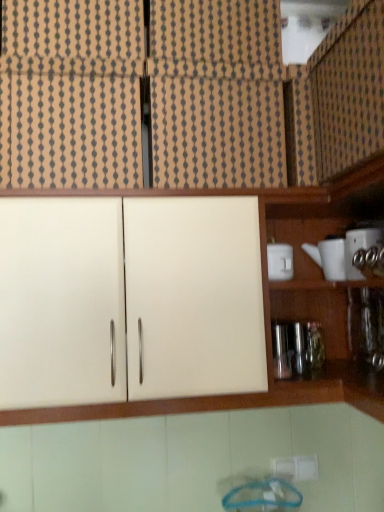
What do you see at coordinates (280, 261) in the screenshot? I see `white glossy cup at upper right, the third appliance in the right-to-left sequence` at bounding box center [280, 261].

I want to click on white glossy teapot at right, which is the first appliance from right to left, so click(x=359, y=247).

The height and width of the screenshot is (512, 384). What do you see at coordinates (70, 131) in the screenshot? I see `white matte cabinet at upper left, which is the third cabinetry in top-to-bottom order` at bounding box center [70, 131].

The width and height of the screenshot is (384, 512). Describe the element at coordinates (314, 345) in the screenshot. I see `metallic silver bottle at right` at that location.

The width and height of the screenshot is (384, 512). Find the location of `white ceramic teapot at right, which ranks as the second appliance in right-to-left order`. white ceramic teapot at right, which ranks as the second appliance in right-to-left order is located at coordinates (329, 258).

Find the location of `matte wood cabinet at upper center, the second cabinetry when ordered from top to bottom`. matte wood cabinet at upper center, the second cabinetry when ordered from top to bottom is located at coordinates (217, 133).

Which of these two, matte wood cabinet at upper right, the 4th cabinetry positioned from the bottom, or white ceramic teapot at right, which ranks as the second appliance in right-to-left order, stands shorter?

Standing shorter between the two is white ceramic teapot at right, which ranks as the second appliance in right-to-left order.

Considering the points (363, 5) and (335, 272), which point is behind, point (363, 5) or point (335, 272)?

Positioned behind is point (335, 272).

Can you tell me how much matte wood cabinet at upper right, the 1th cabinetry in the top-to-bottom sequence, and white ceramic teapot at right, which is the second appliance in left-to-right order, differ in facing direction?

matte wood cabinet at upper right, the 1th cabinetry in the top-to-bottom sequence, and white ceramic teapot at right, which is the second appliance in left-to-right order, are facing 89.6 degrees away from each other.

Is matte wood cabinet at upper right, the 1th cabinetry in the top-to-bottom sequence, touching white ceramic teapot at right, which is the second appliance in left-to-right order?

No, matte wood cabinet at upper right, the 1th cabinetry in the top-to-bottom sequence, is not beside white ceramic teapot at right, which is the second appliance in left-to-right order.

Considering the sizes of matte wood cabinet at upper right, the 4th cabinetry positioned from the bottom, and metallic silver bottle at right in the image, is matte wood cabinet at upper right, the 4th cabinetry positioned from the bottom, taller or shorter than metallic silver bottle at right?

Clearly, matte wood cabinet at upper right, the 4th cabinetry positioned from the bottom, is taller compared to metallic silver bottle at right.

Measure the distance from matte wood cabinet at upper right, the 1th cabinetry in the top-to-bottom sequence, to metallic silver bottle at right.

A distance of 24.94 inches exists between matte wood cabinet at upper right, the 1th cabinetry in the top-to-bottom sequence, and metallic silver bottle at right.

From the image's perspective, would you say matte wood cabinet at upper right, the 1th cabinetry in the top-to-bottom sequence, is positioned over metallic silver bottle at right?

Correct, matte wood cabinet at upper right, the 1th cabinetry in the top-to-bottom sequence, appears higher than metallic silver bottle at right in the image.

From a real-world perspective, is matte wood cabinet at upper right, the 1th cabinetry in the top-to-bottom sequence, above or below metallic silver bottle at right?

Clearly, from a real-world perspective, matte wood cabinet at upper right, the 1th cabinetry in the top-to-bottom sequence, is above metallic silver bottle at right.

Locate an element on the screen. The height and width of the screenshot is (512, 384). the 2nd appliance below when counting from the white glossy teapot at right, which is the first appliance from right to left (from the image's perspective) is located at coordinates (280, 261).

Who is shorter, white glossy teapot at right, the 3th appliance in the left-to-right sequence, or white glossy cup at upper right, arranged as the 1th appliance when viewed from the left?

With less height is white glossy cup at upper right, arranged as the 1th appliance when viewed from the left.

Are white glossy teapot at right, the 3th appliance in the left-to-right sequence, and white glossy cup at upper right, arranged as the 1th appliance when viewed from the left, making contact?

No, white glossy teapot at right, the 3th appliance in the left-to-right sequence, is not making contact with white glossy cup at upper right, arranged as the 1th appliance when viewed from the left.

From the picture: How many degrees apart are the facing directions of matte wood cabinet at upper center, the 3th cabinetry positioned from the bottom, and metallic silver bottle at right?

The angle between the facing direction of matte wood cabinet at upper center, the 3th cabinetry positioned from the bottom, and the facing direction of metallic silver bottle at right is 1.67 degrees.

This screenshot has height=512, width=384. I want to click on bottle lying behind the matte wood cabinet at upper center, the 3th cabinetry positioned from the bottom, so click(314, 345).

Between matte wood cabinet at upper center, the second cabinetry when ordered from top to bottom, and metallic silver bottle at right, which one has smaller size?

metallic silver bottle at right is smaller.

Would you say matte wood cabinet at upper center, the second cabinetry when ordered from top to bottom, is outside metallic silver bottle at right?

matte wood cabinet at upper center, the second cabinetry when ordered from top to bottom, is positioned outside metallic silver bottle at right.

From the picture: Could you tell me if white ceramic teapot at right, which is the second appliance in left-to-right order, is turned towards white glossy cup at upper right, arranged as the 1th appliance when viewed from the left?

No, white ceramic teapot at right, which is the second appliance in left-to-right order, is not aimed at white glossy cup at upper right, arranged as the 1th appliance when viewed from the left.

Is white ceramic teapot at right, which ranks as the second appliance in right-to-left order, placed right next to white glossy cup at upper right, arranged as the 1th appliance when viewed from the left?

No.

Who is taller, white ceramic teapot at right, which ranks as the second appliance in right-to-left order, or white glossy cup at upper right, the third appliance in the right-to-left sequence?

white ceramic teapot at right, which ranks as the second appliance in right-to-left order.

Which appliance is the 1st one when counting from the right side of the white glossy cup at upper right, the third appliance in the right-to-left sequence? Please provide its 2D coordinates.

[(329, 258)]

From a real-world perspective, between white ceramic teapot at right, which ranks as the second appliance in right-to-left order, and matte white cabinet at center, the 4th cabinetry in the top-to-bottom sequence, who is vertically lower?

matte white cabinet at center, the 4th cabinetry in the top-to-bottom sequence, is physically lower.

Which is more to the right, white ceramic teapot at right, which ranks as the second appliance in right-to-left order, or matte white cabinet at center, the first cabinetry from the bottom?

white ceramic teapot at right, which ranks as the second appliance in right-to-left order.

Is point (323, 268) positioned after point (25, 342)?

That is True.

Is matte wood cabinet at upper right, the 1th cabinetry in the top-to-bottom sequence, turned away from white glossy cup at upper right, arranged as the 1th appliance when viewed from the left?

matte wood cabinet at upper right, the 1th cabinetry in the top-to-bottom sequence, is not turned away from white glossy cup at upper right, arranged as the 1th appliance when viewed from the left.

From a real-world perspective, relative to white glossy cup at upper right, arranged as the 1th appliance when viewed from the left, is matte wood cabinet at upper right, the 4th cabinetry positioned from the bottom, vertically above or below?

In terms of real-world spatial position, matte wood cabinet at upper right, the 4th cabinetry positioned from the bottom, is above white glossy cup at upper right, arranged as the 1th appliance when viewed from the left.

Looking at the image, does matte wood cabinet at upper right, the 1th cabinetry in the top-to-bottom sequence, seem bigger or smaller compared to white glossy cup at upper right, the third appliance in the right-to-left sequence?

In the image, matte wood cabinet at upper right, the 1th cabinetry in the top-to-bottom sequence, appears to be larger than white glossy cup at upper right, the third appliance in the right-to-left sequence.

From a real-world perspective, count 3rd cabinetrys upward from the white ceramic teapot at right, which ranks as the second appliance in right-to-left order, and point to it. Please provide its 2D coordinates.

[(349, 89)]

Which cabinetry is the 4th one when counting from the front of the metallic silver bottle at right? Please provide its 2D coordinates.

[(349, 89)]

Looking at the image, which one is located closer to matte white cabinet at center, the 4th cabinetry in the top-to-bottom sequence, white ceramic teapot at right, which is the second appliance in left-to-right order, or matte wood cabinet at upper right, the 1th cabinetry in the top-to-bottom sequence?

matte wood cabinet at upper right, the 1th cabinetry in the top-to-bottom sequence, lies closer to matte white cabinet at center, the 4th cabinetry in the top-to-bottom sequence, than the other object.

Which object lies nearer to the anchor point matte wood cabinet at upper right, the 4th cabinetry positioned from the bottom, white glossy teapot at right, the 3th appliance in the left-to-right sequence, or white ceramic teapot at right, which is the second appliance in left-to-right order?

white glossy teapot at right, the 3th appliance in the left-to-right sequence.

When comparing their distances from matte wood cabinet at upper center, the 3th cabinetry positioned from the bottom, does metallic silver bottle at right or white glossy cup at upper right, arranged as the 1th appliance when viewed from the left, seem further?

metallic silver bottle at right.

From the image, which object appears to be farther from white glossy cup at upper right, arranged as the 1th appliance when viewed from the left, matte white cabinet at center, the 4th cabinetry in the top-to-bottom sequence, or matte wood cabinet at upper right, the 4th cabinetry positioned from the bottom?

The object further to white glossy cup at upper right, arranged as the 1th appliance when viewed from the left, is matte wood cabinet at upper right, the 4th cabinetry positioned from the bottom.

From the image, which object appears to be farther from matte wood cabinet at upper center, the 3th cabinetry positioned from the bottom, white glossy cup at upper right, the third appliance in the right-to-left sequence, or white matte cabinet at upper left, which appears as the second cabinetry when ordered from the bottom?

white glossy cup at upper right, the third appliance in the right-to-left sequence, lies further to matte wood cabinet at upper center, the 3th cabinetry positioned from the bottom, than the other object.

Considering their positions, is matte wood cabinet at upper right, the 1th cabinetry in the top-to-bottom sequence, positioned further to matte wood cabinet at upper center, the second cabinetry when ordered from top to bottom, than matte white cabinet at center, the 4th cabinetry in the top-to-bottom sequence?

Among the two, matte white cabinet at center, the 4th cabinetry in the top-to-bottom sequence, is located further to matte wood cabinet at upper center, the second cabinetry when ordered from top to bottom.

Considering their positions, is matte wood cabinet at upper center, the 3th cabinetry positioned from the bottom, positioned further to white matte cabinet at upper left, which is the third cabinetry in top-to-bottom order, than white glossy cup at upper right, the third appliance in the right-to-left sequence?

white glossy cup at upper right, the third appliance in the right-to-left sequence, is further to white matte cabinet at upper left, which is the third cabinetry in top-to-bottom order.

Looking at the image, which one is located closer to matte white cabinet at center, the 4th cabinetry in the top-to-bottom sequence, matte wood cabinet at upper right, the 1th cabinetry in the top-to-bottom sequence, or metallic silver bottle at right?

matte wood cabinet at upper right, the 1th cabinetry in the top-to-bottom sequence.

This screenshot has width=384, height=512. What are the coordinates of `appliance located between white glossy cup at upper right, arranged as the 1th appliance when viewed from the left, and white glossy teapot at right, which is the first appliance from right to left, in the left-right direction` in the screenshot? It's located at (329, 258).

Locate an element on the screen. This screenshot has height=512, width=384. bottle between matte white cabinet at center, the first cabinetry from the bottom, and white ceramic teapot at right, which is the second appliance in left-to-right order, in the horizontal direction is located at coordinates (314, 345).

I want to click on bottle between white matte cabinet at upper left, which is the third cabinetry in top-to-bottom order, and white ceramic teapot at right, which is the second appliance in left-to-right order, from left to right, so click(x=314, y=345).

Where is `appliance between white matte cabinet at upper left, which is the third cabinetry in top-to-bottom order, and metallic silver bottle at right, in the horizontal direction`? appliance between white matte cabinet at upper left, which is the third cabinetry in top-to-bottom order, and metallic silver bottle at right, in the horizontal direction is located at coordinates (280, 261).